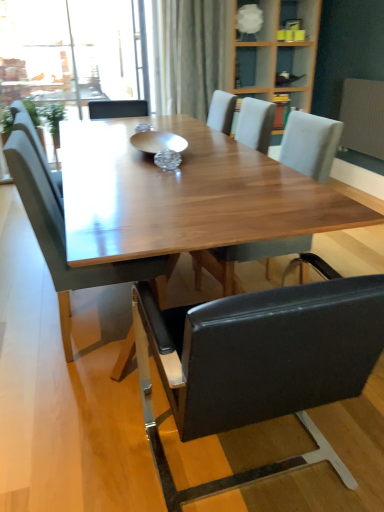
Question: Looking at the image, does leather-like black chair at center, the 2th chair from the right, seem bigger or smaller compared to matte gray chair at left, which appears as the 3th chair when viewed from the right?

Choices:
 (A) big
 (B) small

Answer: (A)

Question: Considering the positions of point (284, 314) and point (94, 272), is point (284, 314) closer or farther from the camera than point (94, 272)?

Choices:
 (A) farther
 (B) closer

Answer: (B)

Question: Considering the real-world distances, which object is closest to the matte gray chair at left, which is the 1th chair in left-to-right order?

Choices:
 (A) leather-like black chair at center, the second chair in the left-to-right sequence
 (B) gold metallic bowl at center
 (C) light gray fabric chair at center, which is the first chair from right to left
 (D) white textured radiator at right
 (E) white frosted glass lampshade at upper center

Answer: (A)

Question: Which of these objects is positioned closest to the white frosted glass lampshade at upper center?

Choices:
 (A) light gray fabric chair at center, which is the first chair from right to left
 (B) matte gray chair at left, which is the 1th chair in left-to-right order
 (C) leather-like black chair at center, the second chair in the left-to-right sequence
 (D) white textured radiator at right
 (E) gold metallic bowl at center

Answer: (D)